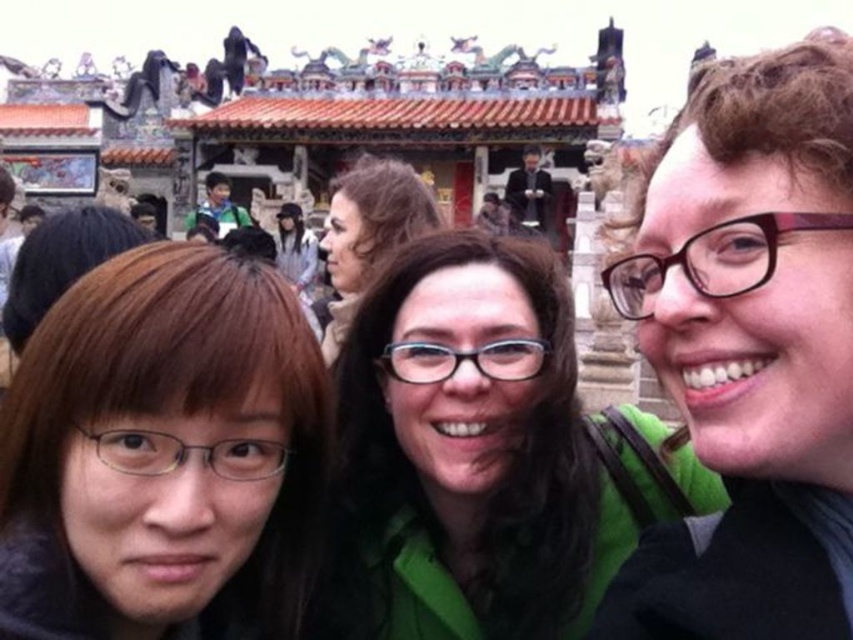
Which is more to the right, brown hair at center or green fabric shirt at upper left?

brown hair at center

Does brown hair at center have a larger size compared to green fabric shirt at upper left?

Indeed, brown hair at center has a larger size compared to green fabric shirt at upper left.

The width and height of the screenshot is (853, 640). What are the coordinates of `brown hair at center` in the screenshot? It's located at (163, 452).

Does brown hair at center have a greater width compared to matte black glasses at center?

Yes, brown hair at center is wider than matte black glasses at center.

Between brown hair at center and matte black glasses at center, which one has more height?

brown hair at center

Describe the element at coordinates (163, 452) in the screenshot. I see `brown hair at center` at that location.

Locate an element on the screen. The image size is (853, 640). brown hair at center is located at coordinates (163, 452).

Consider the image. Is matte black glasses at center positioned before green fabric shirt at upper left?

Yes, it is in front of green fabric shirt at upper left.

Which is in front, point (344, 196) or point (221, 193)?

Point (344, 196) is in front.

I want to click on matte black glasses at center, so click(368, 234).